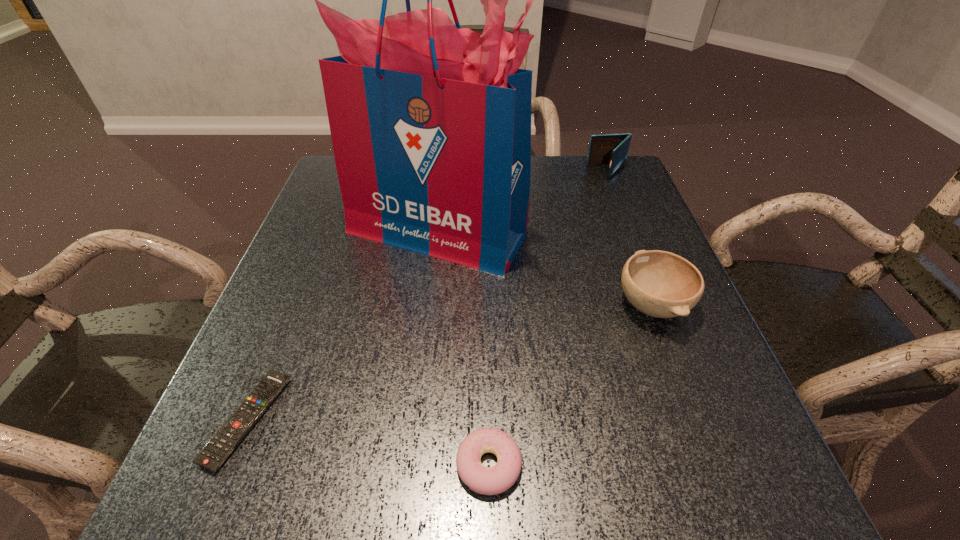
Where is `vacant space located 0.060m on the back of the bowl`? vacant space located 0.060m on the back of the bowl is located at coordinates tap(634, 256).

Locate an element on the screen. This screenshot has height=540, width=960. vacant region located on the back of the doughnut is located at coordinates (488, 389).

This screenshot has width=960, height=540. Identify the location of vacant space situated on the right of the shortest object. (448, 420).

The image size is (960, 540). What are the coordinates of `grocery bag located in the far edge section of the desktop` in the screenshot? It's located at (430, 123).

In order to click on wallet present at the far edge in this screenshot , I will do pos(612,149).

Find the location of `doughnut that is at the near edge`. doughnut that is at the near edge is located at coordinates (493, 480).

Where is `remote control at the near edge`? The height and width of the screenshot is (540, 960). remote control at the near edge is located at coordinates (215, 453).

Where is `grocery bag situated at the left edge`? The width and height of the screenshot is (960, 540). grocery bag situated at the left edge is located at coordinates [430, 123].

Locate an element on the screen. remote control located at the left edge is located at coordinates (215, 453).

Image resolution: width=960 pixels, height=540 pixels. Identify the location of wallet present at the right edge. (612, 149).